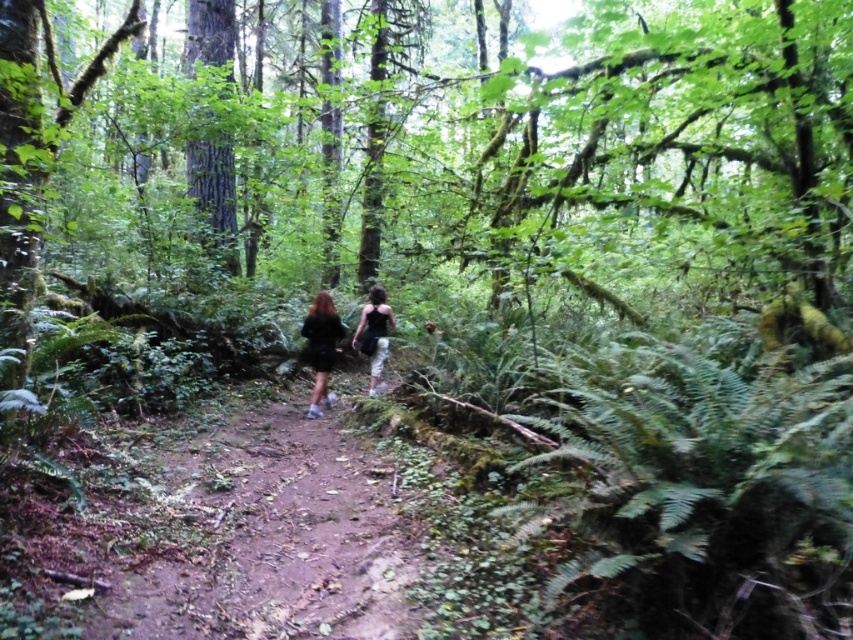
Who is shorter, dirt path at center or black fabric dress at center?

dirt path at center is shorter.

Consider the image. Can you confirm if dirt path at center is positioned above black fabric dress at center?

No.

Who is more forward, (375, 536) or (352, 340)?

Positioned in front is point (375, 536).

This screenshot has height=640, width=853. In order to click on dirt path at center in this screenshot , I will do `click(271, 538)`.

Can you confirm if black matte dress at center is positioned below black fabric dress at center?

Yes.

Is point (308, 310) less distant than point (373, 336)?

No.

The height and width of the screenshot is (640, 853). What do you see at coordinates (321, 346) in the screenshot?
I see `black matte dress at center` at bounding box center [321, 346].

Find the location of a particular element. The height and width of the screenshot is (640, 853). black matte dress at center is located at coordinates (321, 346).

Is dirt path at center taller than black matte dress at center?

No, dirt path at center is not taller than black matte dress at center.

Is point (331, 493) less distant than point (337, 317)?

Yes.

Which is in front, point (279, 513) or point (318, 332)?

Point (279, 513) is in front.

Identify the location of dirt path at center. Image resolution: width=853 pixels, height=640 pixels. (271, 538).